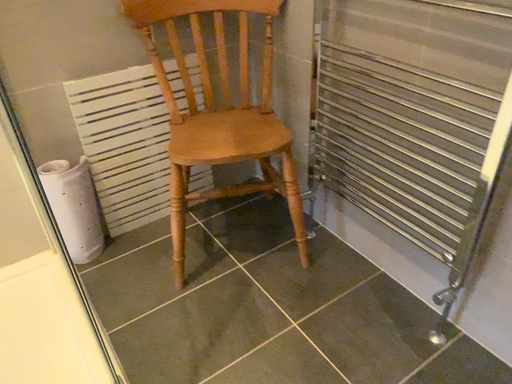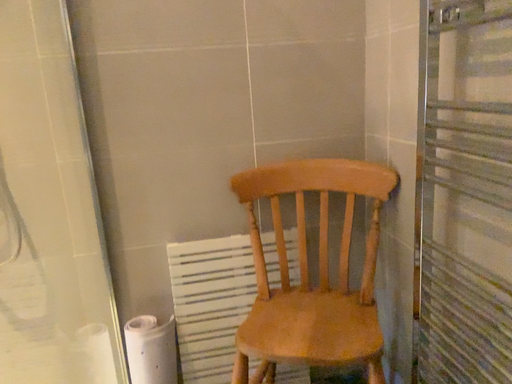
Question: Which way did the camera rotate in the video?

Choices:
 (A) rotated right
 (B) rotated left

Answer: (B)